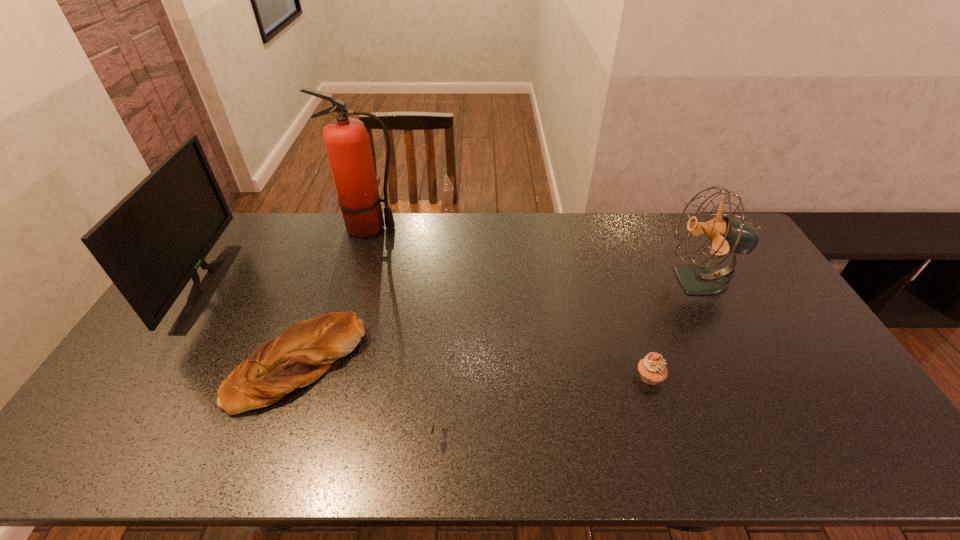
At what (x,y) coordinates should I click in order to perform the action: click on fire extinguisher. Please return your answer as a coordinate pair (x, y). Looking at the image, I should click on (347, 141).

The height and width of the screenshot is (540, 960). I want to click on the leftmost object, so click(x=151, y=244).

The image size is (960, 540). What are the coordinates of `the second tallest object` in the screenshot? It's located at (151, 244).

I want to click on fan, so click(x=727, y=234).

Find the location of `the rightmost object`. the rightmost object is located at coordinates (727, 234).

I want to click on cupcake, so click(x=652, y=369).

Identify the location of bread. This screenshot has height=540, width=960. (305, 351).

Find the location of a particular element. This screenshot has width=960, height=540. the third object from right to left is located at coordinates (432, 428).

Find the location of a particular element. The image size is (960, 540). vacant region located 0.170m on the nozzle of the fire extinguisher is located at coordinates (447, 228).

This screenshot has height=540, width=960. Identify the location of vacant space positioned on the front-facing side of the monitor. (298, 286).